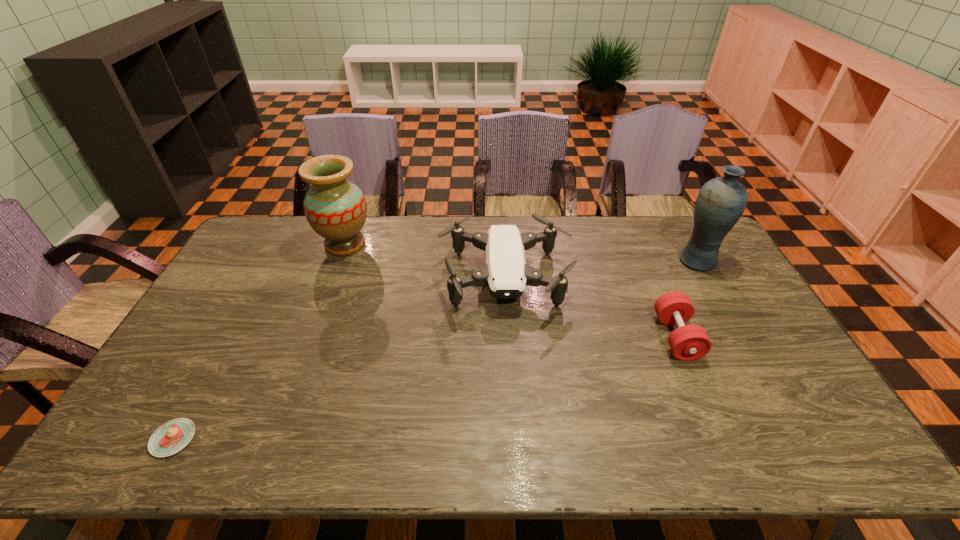
Where is `object that is the third nearest to the second object from right to left`? The height and width of the screenshot is (540, 960). object that is the third nearest to the second object from right to left is located at coordinates (336, 209).

You are a GUI agent. You are given a task and a screenshot of the screen. Output one action in this format:
    pyautogui.click(x=<x>, y=<y>)
    Task: Click on the third closest object to the third object from right to left
    The height and width of the screenshot is (540, 960).
    Given the screenshot: What is the action you would take?
    pyautogui.click(x=720, y=203)

The height and width of the screenshot is (540, 960). I want to click on vacant space that satisfies the following two spatial constraints: 1. on the camera side of the dumbbell; 2. on the left side of the third shortest object, so coord(508,337).